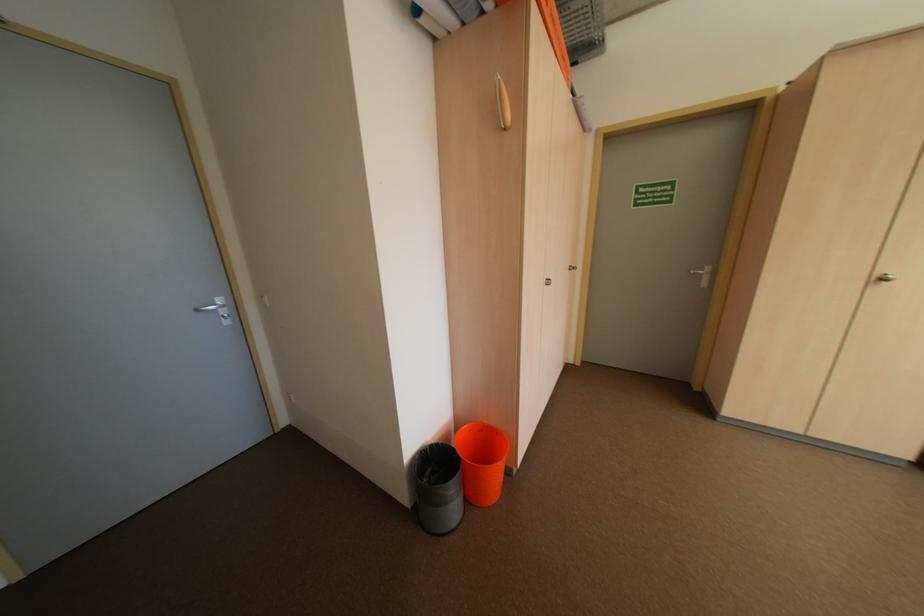
Find where to lift the orange trash can. Please return your answer as a coordinate pair (x, y).

(481, 461)